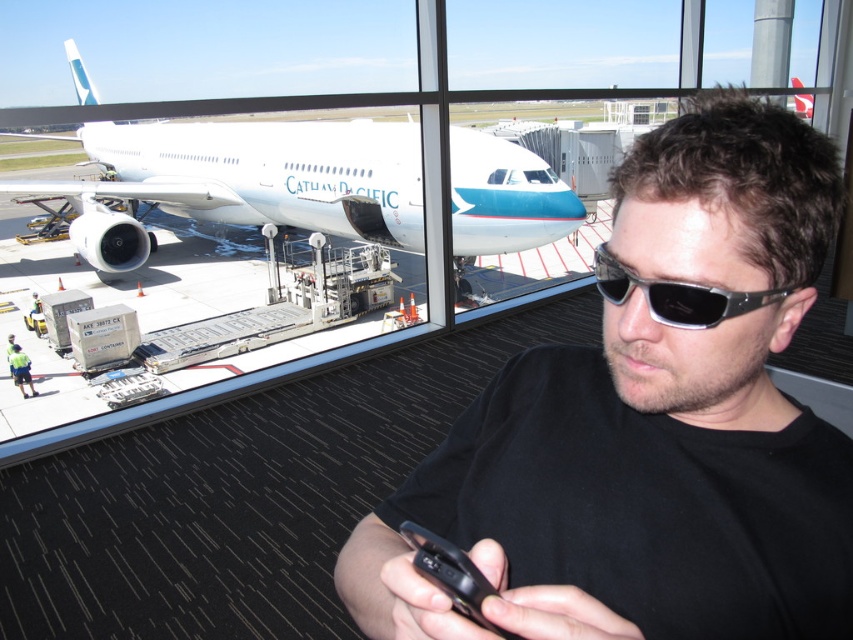
You are an airport security officer checking the layout of the terminal. There is a black matte shirt at center in the scene. Can you confirm its exact location using coordinates?

The black matte shirt at center is located at coordinates point (651, 422).

Based on the scene description, where is the white glossy airplane at upper left located in the image?

The white glossy airplane at upper left is located at point coordinates of (263, 173).